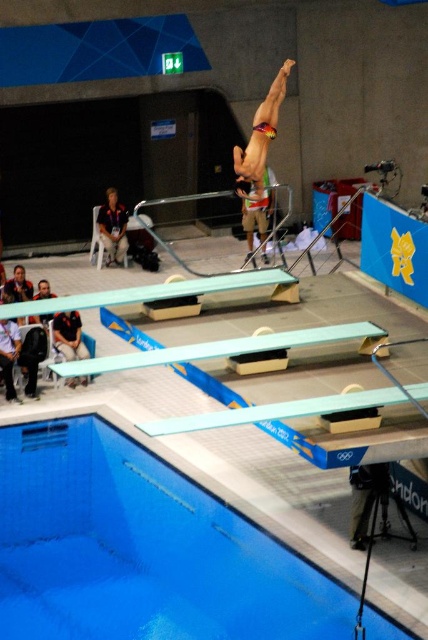
Question: Which point is closer to the camera taking this photo?

Choices:
 (A) (401, 394)
 (B) (247, 182)
 (C) (309, 550)
 (D) (80, 326)

Answer: (A)

Question: Is multicolored bikini at center further to the viewer compared to dark gray fabric jacket at lower left?

Choices:
 (A) no
 (B) yes

Answer: (A)

Question: Estimate the real-world distances between objects in this image. Which object is farther from the dark gray fabric jacket at lower left?

Choices:
 (A) matte yellow swimsuit at center
 (B) multicolored bikini at center

Answer: (A)

Question: Is blue smooth water at lower left in front of dark gray fabric jacket at lower left?

Choices:
 (A) no
 (B) yes

Answer: (B)

Question: Which of the following is the farthest from the observer?

Choices:
 (A) (68, 333)
 (B) (249, 150)
 (C) (261, 204)

Answer: (C)

Question: Does multicolored bikini at center appear on the left side of dark gray fabric jacket at lower left?

Choices:
 (A) yes
 (B) no

Answer: (B)